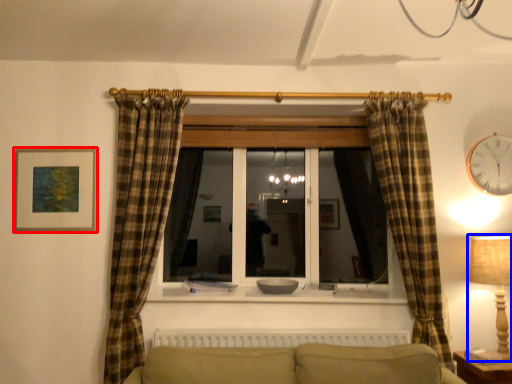
Question: Which object is further to the camera taking this photo, picture frame (highlighted by a red box) or table lamp (highlighted by a blue box)?

Choices:
 (A) picture frame
 (B) table lamp

Answer: (A)